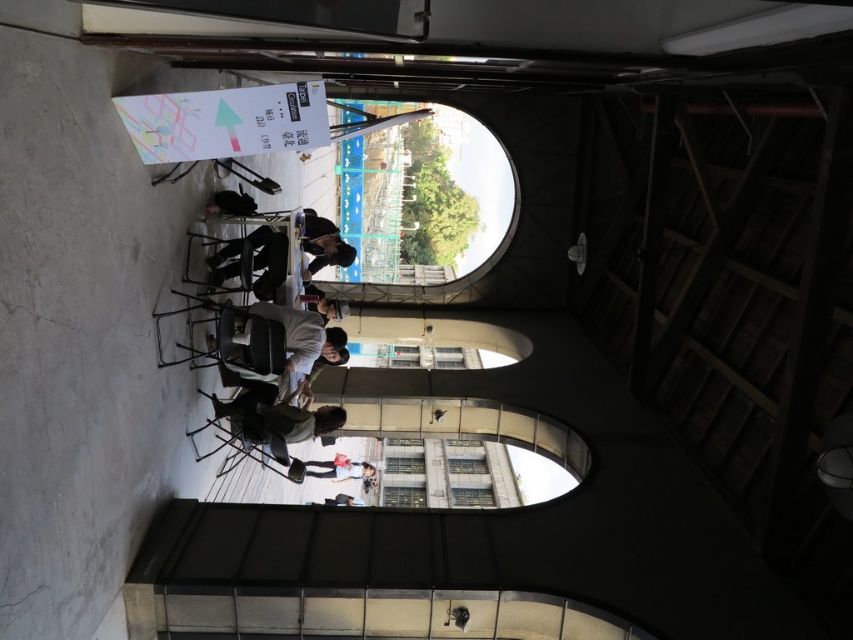
Question: Does green fabric shirt at lower center appear on the left side of light pink fabric at center?

Choices:
 (A) yes
 (B) no

Answer: (B)

Question: Which point is closer to the camera?

Choices:
 (A) green fabric shirt at lower center
 (B) light pink fabric at center

Answer: (A)

Question: Which point is farther from the camera taking this photo?

Choices:
 (A) (337, 422)
 (B) (366, 464)

Answer: (B)

Question: Which object appears closest to the camera in this image?

Choices:
 (A) green fabric shirt at lower center
 (B) light pink fabric at center

Answer: (A)

Question: Can you confirm if green fabric shirt at lower center is wider than light pink fabric at center?

Choices:
 (A) yes
 (B) no

Answer: (A)

Question: Can you confirm if green fabric shirt at lower center is positioned to the right of light pink fabric at center?

Choices:
 (A) yes
 (B) no

Answer: (A)